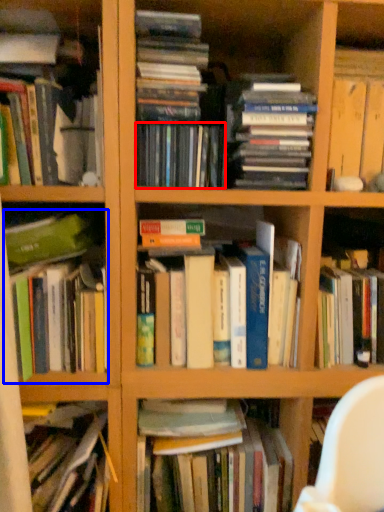
Question: Which object is closer to the camera taking this photo, book (highlighted by a red box) or book (highlighted by a blue box)?

Choices:
 (A) book
 (B) book

Answer: (B)